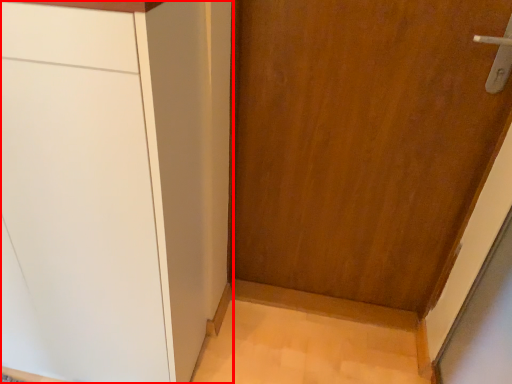
Question: From the image's perspective, what is the correct spatial relationship of cabinetry (annotated by the red box) in relation to door?

Choices:
 (A) below
 (B) above

Answer: (A)